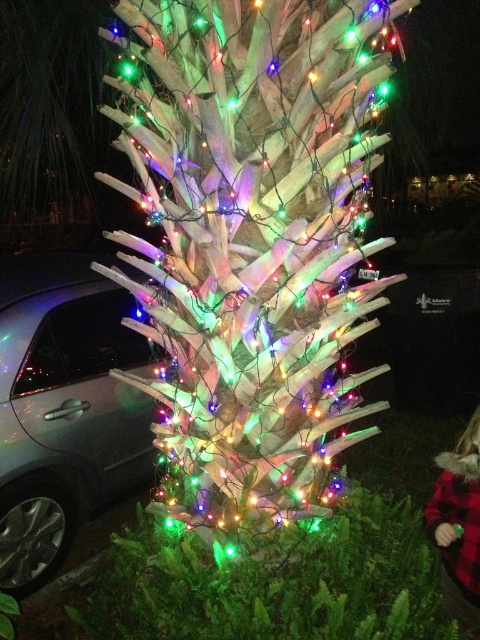
Between iridescent white lights at center and red plaid coat at lower right, which one has less height?

With less height is red plaid coat at lower right.

What do you see at coordinates (254, 241) in the screenshot?
I see `iridescent white lights at center` at bounding box center [254, 241].

Is point (153, 170) positioned before point (457, 611)?

No, (153, 170) is further to viewer.

At what (x,y) coordinates should I click in order to perform the action: click on iridescent white lights at center. Please return your answer as a coordinate pair (x, y). Looking at the image, I should click on (254, 241).

Who is positioned more to the left, satin silver car at left or red plaid coat at lower right?

Positioned to the left is satin silver car at left.

What are the coordinates of `satin silver car at left` in the screenshot? It's located at (64, 406).

Between iridescent white lights at center and satin silver car at left, which one is positioned lower?

Positioned lower is satin silver car at left.

Looking at this image, between iridescent white lights at center and satin silver car at left, which one appears on the right side from the viewer's perspective?

Positioned to the right is iridescent white lights at center.

Which is in front, point (278, 134) or point (104, 369)?

Point (278, 134)

Locate an element on the screen. iridescent white lights at center is located at coordinates (254, 241).